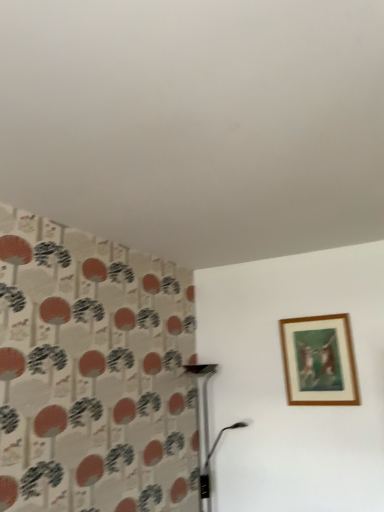
Find the location of a particular element. Image resolution: width=384 pixels, height=512 pixels. wooden frame at upper right is located at coordinates (319, 361).

The height and width of the screenshot is (512, 384). Describe the element at coordinates (319, 361) in the screenshot. I see `wooden frame at upper right` at that location.

Find the location of a particular element. Image resolution: width=384 pixels, height=512 pixels. metallic silver table lamp at lower center is located at coordinates (208, 428).

This screenshot has width=384, height=512. Describe the element at coordinates (208, 428) in the screenshot. I see `metallic silver table lamp at lower center` at that location.

At what (x,y) coordinates should I click in order to perform the action: click on wooden frame at upper right. Please return your answer as a coordinate pair (x, y). The height and width of the screenshot is (512, 384). Looking at the image, I should click on (319, 361).

Between wooden frame at upper right and metallic silver table lamp at lower center, which one appears on the left side from the viewer's perspective?

metallic silver table lamp at lower center is more to the left.

Considering the positions of objects wooden frame at upper right and metallic silver table lamp at lower center in the image provided, who is behind, wooden frame at upper right or metallic silver table lamp at lower center?

Positioned behind is wooden frame at upper right.

Considering the positions of points (286, 353) and (208, 501), is point (286, 353) closer to camera compared to point (208, 501)?

That is True.

From the image's perspective, between wooden frame at upper right and metallic silver table lamp at lower center, who is located below?

metallic silver table lamp at lower center appears lower in the image.

In the scene shown: From a real-world perspective, is wooden frame at upper right positioned above or below metallic silver table lamp at lower center?

wooden frame at upper right is above metallic silver table lamp at lower center.

Is wooden frame at upper right wider or thinner than metallic silver table lamp at lower center?

Clearly, wooden frame at upper right has less width compared to metallic silver table lamp at lower center.

Between wooden frame at upper right and metallic silver table lamp at lower center, which one has less height?

wooden frame at upper right is shorter.

Is wooden frame at upper right bigger than metallic silver table lamp at lower center?

Incorrect, wooden frame at upper right is not larger than metallic silver table lamp at lower center.

Is wooden frame at upper right inside the boundaries of metallic silver table lamp at lower center, or outside?

wooden frame at upper right is outside metallic silver table lamp at lower center.

Are wooden frame at upper right and metallic silver table lamp at lower center far apart?

No, wooden frame at upper right is not far from metallic silver table lamp at lower center.

Is wooden frame at upper right oriented towards metallic silver table lamp at lower center?

No, wooden frame at upper right is not facing towards metallic silver table lamp at lower center.

Locate an element on the screen. The image size is (384, 512). picture frame above the metallic silver table lamp at lower center (from the image's perspective) is located at coordinates (319, 361).

Considering the relative positions of metallic silver table lamp at lower center and wooden frame at upper right in the image provided, is metallic silver table lamp at lower center to the right of wooden frame at upper right from the viewer's perspective?

No.

Which object is closer to the camera taking this photo, metallic silver table lamp at lower center or wooden frame at upper right?

metallic silver table lamp at lower center is closer to the camera.

Is point (196, 364) more distant than point (290, 353)?

That is True.

From the image's perspective, would you say metallic silver table lamp at lower center is positioned over wooden frame at upper right?

Incorrect, from the image's perspective, metallic silver table lamp at lower center is lower than wooden frame at upper right.

From a real-world perspective, between metallic silver table lamp at lower center and wooden frame at upper right, who is vertically lower?

metallic silver table lamp at lower center is physically lower.

Which of these two, metallic silver table lamp at lower center or wooden frame at upper right, is thinner?

Thinner between the two is wooden frame at upper right.

Is metallic silver table lamp at lower center taller or shorter than wooden frame at upper right?

Clearly, metallic silver table lamp at lower center is taller compared to wooden frame at upper right.

Can you confirm if metallic silver table lamp at lower center is bigger than wooden frame at upper right?

Yes, metallic silver table lamp at lower center is bigger than wooden frame at upper right.

Based on the photo, is metallic silver table lamp at lower center outside of wooden frame at upper right?

Indeed, metallic silver table lamp at lower center is completely outside wooden frame at upper right.

Is metallic silver table lamp at lower center touching wooden frame at upper right?

No, metallic silver table lamp at lower center is not with wooden frame at upper right.

Is metallic silver table lamp at lower center aimed at wooden frame at upper right?

No, metallic silver table lamp at lower center is not facing towards wooden frame at upper right.

What's the angular difference between metallic silver table lamp at lower center and wooden frame at upper right's facing directions?

The angular difference between metallic silver table lamp at lower center and wooden frame at upper right is 0.703 degrees.

Locate an element on the screen. The width and height of the screenshot is (384, 512). table lamp in front of the wooden frame at upper right is located at coordinates [x=208, y=428].

Where is `table lamp on the left of wooden frame at upper right`? table lamp on the left of wooden frame at upper right is located at coordinates (208, 428).

In the image, there is a wooden frame at upper right. Where is `table lamp below it (from the image's perspective)`? Image resolution: width=384 pixels, height=512 pixels. table lamp below it (from the image's perspective) is located at coordinates (208, 428).